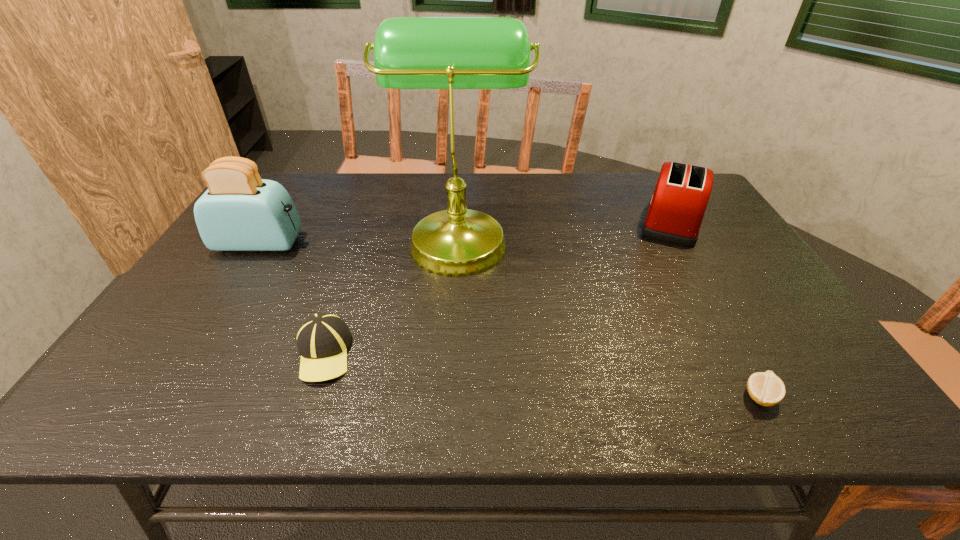
This screenshot has height=540, width=960. I want to click on blank space located 0.160m on the side of the taller toaster with the lever, so click(357, 243).

Image resolution: width=960 pixels, height=540 pixels. I want to click on blank area located 0.350m on the front of the right toaster, so click(x=738, y=340).

Locate an element on the screen. vacant space located on the back of the lemon is located at coordinates (720, 325).

Where is `lamp at the far edge`? The image size is (960, 540). lamp at the far edge is located at coordinates (450, 53).

Where is `toaster present at the far edge`? This screenshot has height=540, width=960. toaster present at the far edge is located at coordinates (676, 209).

The width and height of the screenshot is (960, 540). In order to click on baseball cap located in the near edge section of the desktop in this screenshot , I will do `click(322, 340)`.

Where is `lemon at the near edge`? The height and width of the screenshot is (540, 960). lemon at the near edge is located at coordinates (765, 388).

Image resolution: width=960 pixels, height=540 pixels. I want to click on object located at the left edge, so click(239, 211).

Identify the location of toaster located in the right edge section of the desktop. This screenshot has width=960, height=540. (676, 209).

This screenshot has height=540, width=960. What are the coordinates of `lemon located in the right edge section of the desktop` in the screenshot? It's located at [765, 388].